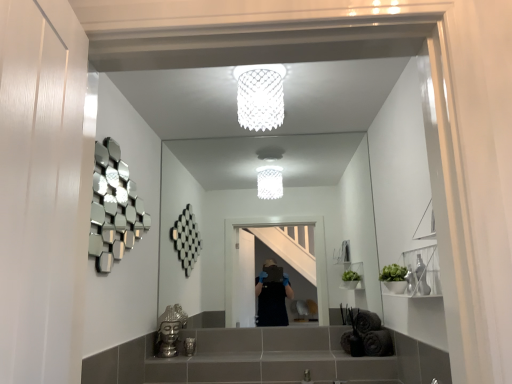
Question: Are white mesh light fixture at upper center and clear glass mirror at center located far from each other?

Choices:
 (A) yes
 (B) no

Answer: (A)

Question: Does white mesh light fixture at upper center have a larger size compared to clear glass mirror at center?

Choices:
 (A) no
 (B) yes

Answer: (A)

Question: Is white mesh light fixture at upper center at the right side of clear glass mirror at center?

Choices:
 (A) yes
 (B) no

Answer: (B)

Question: Is white mesh light fixture at upper center shorter than clear glass mirror at center?

Choices:
 (A) no
 (B) yes

Answer: (B)

Question: Is white mesh light fixture at upper center not inside clear glass mirror at center?

Choices:
 (A) no
 (B) yes

Answer: (B)

Question: Considering the relative sizes of white mesh light fixture at upper center and clear glass mirror at center in the image provided, is white mesh light fixture at upper center smaller than clear glass mirror at center?

Choices:
 (A) yes
 (B) no

Answer: (A)

Question: From a real-world perspective, is white mesh light fixture at upper center positioned over metallic silver toiletry at lower center based on gravity?

Choices:
 (A) yes
 (B) no

Answer: (A)

Question: From a real-world perspective, is white mesh light fixture at upper center located beneath metallic silver toiletry at lower center?

Choices:
 (A) yes
 (B) no

Answer: (B)

Question: Does white mesh light fixture at upper center have a greater width compared to metallic silver toiletry at lower center?

Choices:
 (A) yes
 (B) no

Answer: (A)

Question: Does white mesh light fixture at upper center have a greater height compared to metallic silver toiletry at lower center?

Choices:
 (A) no
 (B) yes

Answer: (B)

Question: Is metallic silver toiletry at lower center at the back of white mesh light fixture at upper center?

Choices:
 (A) yes
 (B) no

Answer: (B)

Question: Is metallic silver toiletry at lower center surrounded by white mesh light fixture at upper center?

Choices:
 (A) no
 (B) yes

Answer: (A)

Question: Is clear glass mirror at center further to the viewer compared to white mesh light fixture at upper center?

Choices:
 (A) no
 (B) yes

Answer: (B)